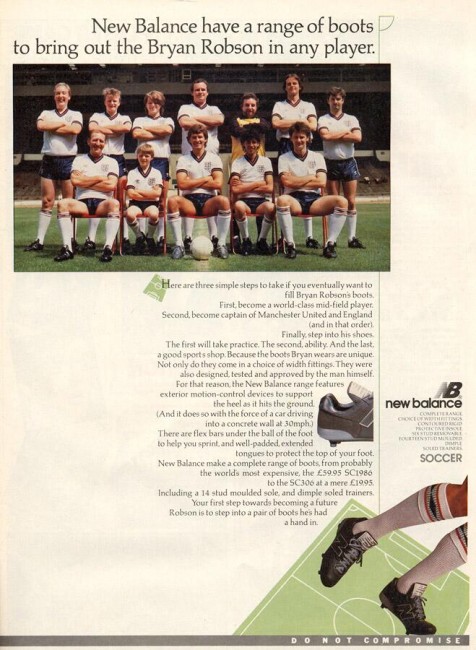
Locate an element on the screen. The height and width of the screenshot is (650, 476). chairs is located at coordinates (x=83, y=214), (x=143, y=214), (x=201, y=214), (x=255, y=214), (x=307, y=214).